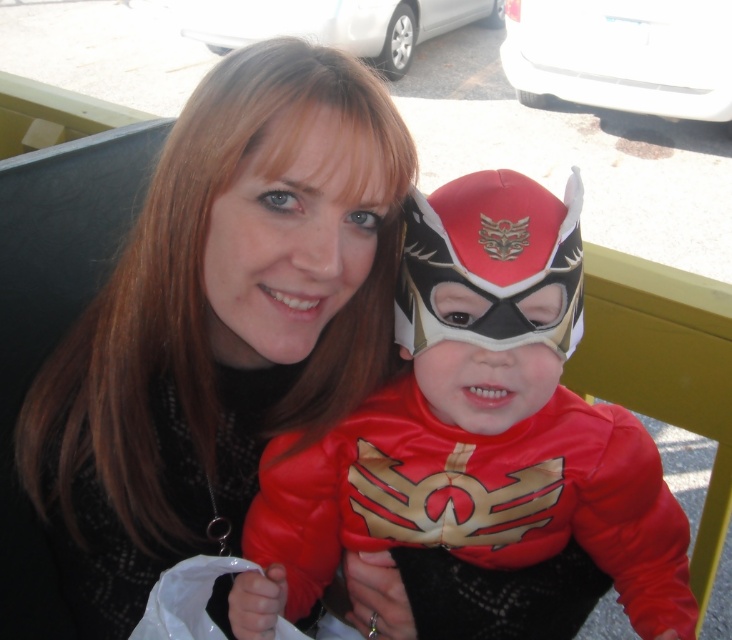
You are a photographer trying to capture a clear photo of the matte black hair at upper center and the shiny red costume at center. Which object should you focus on first if you want to ensure both are in focus, considering their sizes?

The matte black hair at upper center has a larger size compared to the shiny red costume at center, so you should focus on the matte black hair at upper center first to ensure both are in focus.

You are a photographer trying to capture a photo of the matte black hair at upper center and the shiny red costume at center. Which object is positioned higher in the frame?

The matte black hair at upper center is located above the shiny red costume at center, so it is positioned higher in the frame.

You are a photographer taking a picture of the matte black hair at upper center and the shiny red costume at center. Which object will appear narrower in the photo?

The matte black hair at upper center will appear narrower in the photo since it is thinner than the shiny red costume at center.